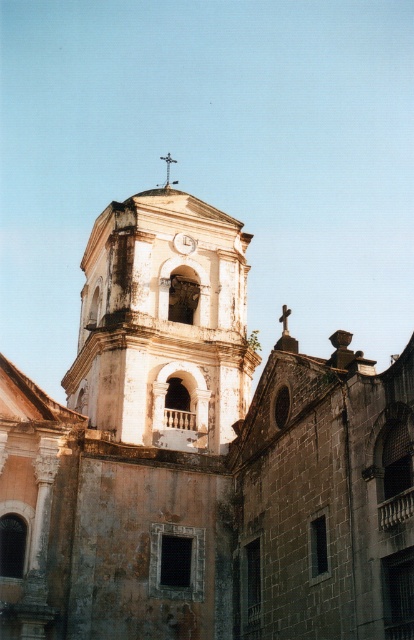
You are standing in front of the historic church tower and want to take a photo that includes both the white stone bell tower at center and the metallic cross at upper center. Which object should you position to the left side of your frame to ensure both are visible?

You should position the metallic cross at upper center to the left side of your frame because the white stone bell tower at center is to the right of the metallic cross at upper center, so placing the cross on the left will allow the tower to naturally appear on the right side while keeping both elements within the frame.

In the scene shown: You are a drone operator tasked with capturing aerial footage of the historic church tower. Your drone has a maximum flight range of 130 meters. If you are positioned at the metallic cross at upper center, can your drone reach the metallic silver clock at center without exceeding its range?

The metallic silver clock at center is 134.01 meters away from the metallic cross at upper center. Since the drone has a maximum range of 130 meters, it cannot reach the metallic silver clock at center without exceeding its range.